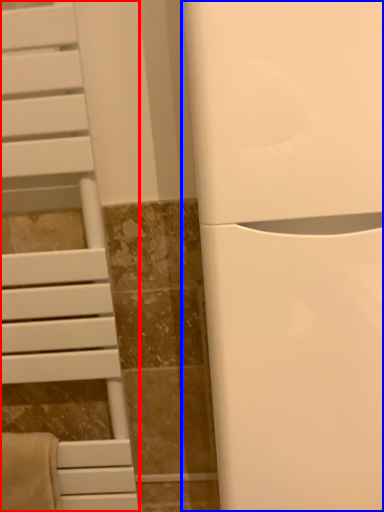
Question: Among these objects, which one is nearest to the camera, furniture (highlighted by a red box) or appliance (highlighted by a blue box)?

Choices:
 (A) furniture
 (B) appliance

Answer: (B)